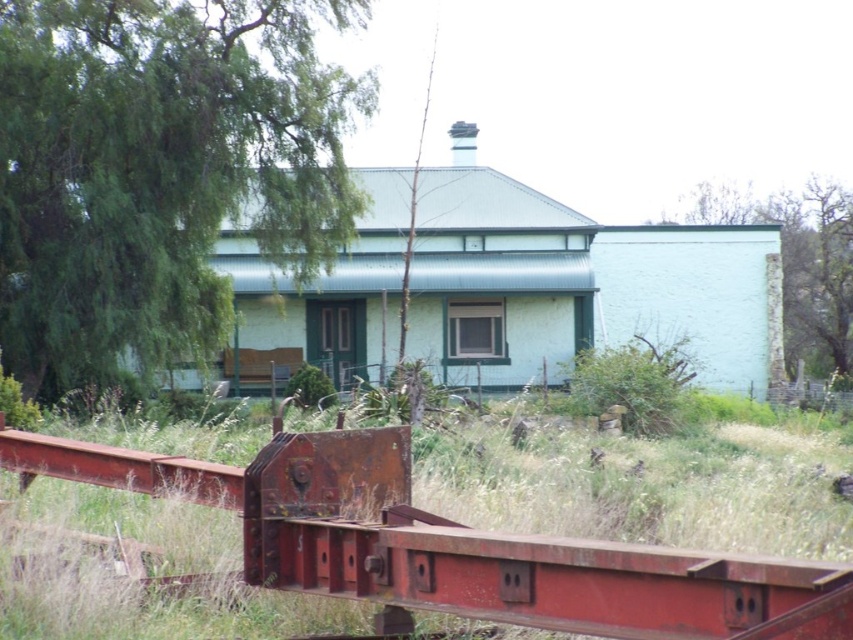
Is green leafy tree at upper left wider than green rough stone wall at upper right?

In fact, green leafy tree at upper left might be narrower than green rough stone wall at upper right.

Does point (35, 164) come behind point (833, 209)?

No, (35, 164) is in front of (833, 209).

Between point (113, 337) and point (801, 288), which one is positioned in front?

Point (113, 337) is in front.

The width and height of the screenshot is (853, 640). What are the coordinates of `green leafy tree at upper left` in the screenshot? It's located at (160, 168).